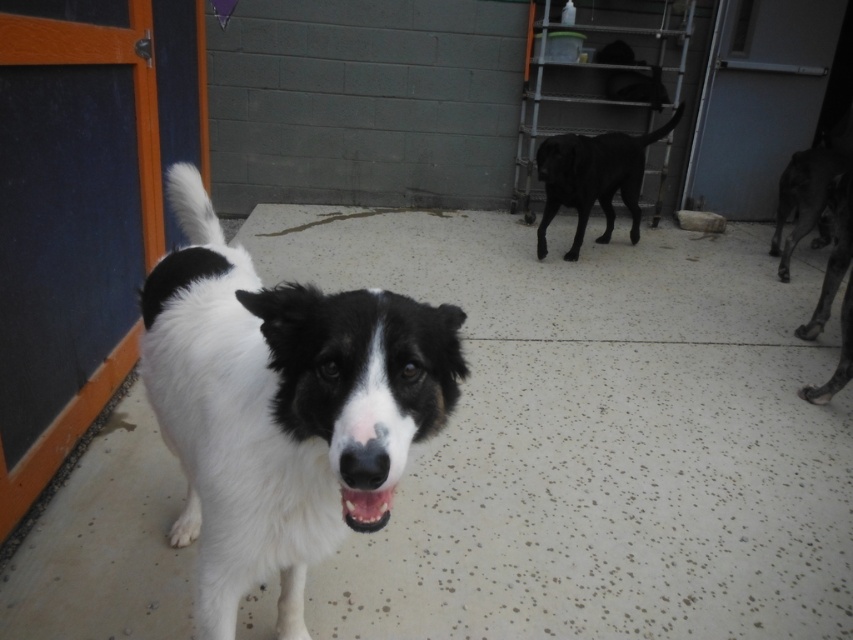
You are standing at the point with coordinates point (584,209) and want to walk towards the point with coordinates point (358,493). Which direction should you face to move towards your destination?

To move from point (584,209) to point (358,493), you should face northeast because the destination is northeast of your current position.

From the picture: You are standing at the point with coordinates point [386,490] and want to walk to the point with coordinates point [229,483]. Which direction should you move in to reach your destination?

You should move forward because point [229,483] is behind point [386,490], meaning it is in the direction you are facing.

You are a photographer trying to capture a group photo of the white fur dog at center and the black smooth dog at center. However, you notice that one dog is blocking the other in the current arrangement. Which dog is currently blocking the other?

The white fur dog at center is positioned under the black smooth dog at center, so the black smooth dog at center is blocking the white fur dog at center in the current arrangement.